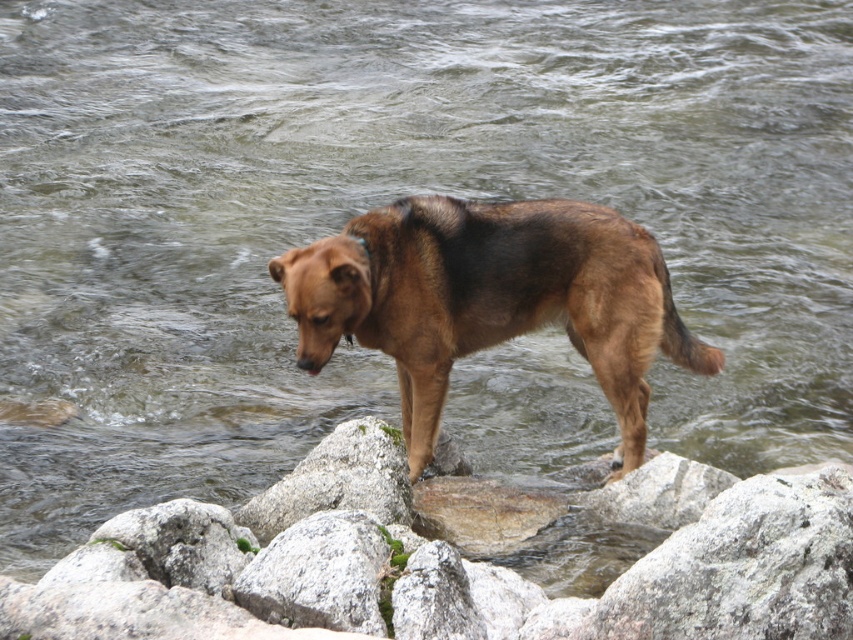
Question: Which point is farther to the camera?

Choices:
 (A) gray rock at center
 (B) brown furry dog at center

Answer: (B)

Question: Among these points, which one is farthest from the camera?

Choices:
 (A) (627, 340)
 (B) (407, 637)

Answer: (A)

Question: Is gray rock at center smaller than brown furry dog at center?

Choices:
 (A) yes
 (B) no

Answer: (A)

Question: Can you confirm if gray rock at center is positioned above brown furry dog at center?

Choices:
 (A) yes
 (B) no

Answer: (B)

Question: Can you confirm if gray rock at center is positioned to the right of brown furry dog at center?

Choices:
 (A) yes
 (B) no

Answer: (B)